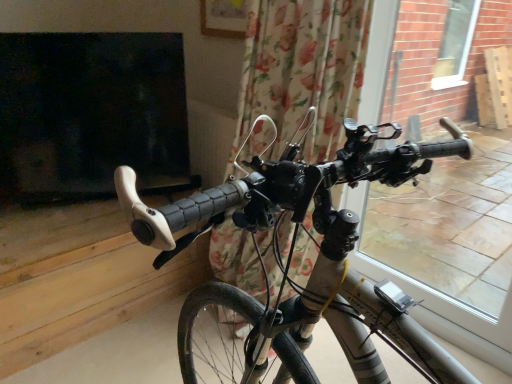
Where is `transparent glass window at right`? transparent glass window at right is located at coordinates (447, 231).

Where is `floral fabric curtain at center`? floral fabric curtain at center is located at coordinates (303, 71).

Is transparent glass window at right far away from floral fabric curtain at center?

Absolutely, transparent glass window at right is distant from floral fabric curtain at center.

Could you tell me if transparent glass window at right is turned towards floral fabric curtain at center?

Yes, transparent glass window at right is facing floral fabric curtain at center.

From a real-world perspective, is transparent glass window at right physically below floral fabric curtain at center?

Yes.

Which object is further away from the camera, transparent glass window at right or floral fabric curtain at center?

transparent glass window at right is further from the camera.

From a real-world perspective, which object rests below the other?

In real-world perspective, matte black handlebars at center is lower.

How distant is transparent glass window at right from matte black handlebars at center?

transparent glass window at right and matte black handlebars at center are 1.56 meters apart.

Considering the relative sizes of transparent glass window at right and matte black handlebars at center in the image provided, is transparent glass window at right smaller than matte black handlebars at center?

Correct, transparent glass window at right occupies less space than matte black handlebars at center.

Is matte black handlebars at center completely or partially inside transparent glass window at right?

No.

Is floral fabric curtain at center turned away from transparent glass window at right?

floral fabric curtain at center is not turned away from transparent glass window at right.

Considering the positions of point (320, 49) and point (459, 296), is point (320, 49) closer or farther from the camera than point (459, 296)?

Point (320, 49) is positioned closer to the camera compared to point (459, 296).

Between floral fabric curtain at center and transparent glass window at right, which one has larger width?

Wider between the two is floral fabric curtain at center.

In terms of width, does matte black handlebars at center look wider or thinner when compared to transparent glass window at right?

In the image, matte black handlebars at center appears to be wider than transparent glass window at right.

Considering the sizes of objects matte black handlebars at center and transparent glass window at right in the image provided, who is taller, matte black handlebars at center or transparent glass window at right?

Standing taller between the two is transparent glass window at right.

Identify the location of bicycle below the transparent glass window at right (from a real-world perspective). (316, 261).

From the image's perspective, which is below, matte black handlebars at center or transparent glass window at right?

matte black handlebars at center is shown below in the image.

Which is farther from the camera, (118, 193) or (289, 237)?

Point (289, 237)

Between matte black handlebars at center and floral fabric curtain at center, which one is positioned in front?

matte black handlebars at center is closer to the camera.

From a real-world perspective, who is located higher, matte black handlebars at center or floral fabric curtain at center?

floral fabric curtain at center, from a real-world perspective.

Is point (277, 105) positioned behind point (292, 343)?

Yes, it is behind point (292, 343).

Is matte black handlebars at center at the back of floral fabric curtain at center?

floral fabric curtain at center is not turned away from matte black handlebars at center.

Is the surface of floral fabric curtain at center in direct contact with matte black handlebars at center?

No, floral fabric curtain at center is not in contact with matte black handlebars at center.

From the image's perspective, which object appears higher, floral fabric curtain at center or matte black handlebars at center?

floral fabric curtain at center appears higher in the image.

The image size is (512, 384). I want to click on curtain that appears in front of the transparent glass window at right, so click(x=303, y=71).

Find the location of a particular element. The image size is (512, 384). bicycle that appears on the left of transparent glass window at right is located at coordinates (316, 261).

Which object lies nearer to the anchor point transparent glass window at right, matte black handlebars at center or floral fabric curtain at center?

Based on the image, floral fabric curtain at center appears to be nearer to transparent glass window at right.

Considering their positions, is matte black handlebars at center positioned closer to floral fabric curtain at center than transparent glass window at right?

matte black handlebars at center is positioned closer to the anchor floral fabric curtain at center.

Estimate the real-world distances between objects in this image. Which object is closer to matte black handlebars at center, floral fabric curtain at center or transparent glass window at right?

floral fabric curtain at center.

In the scene shown: Estimate the real-world distances between objects in this image. Which object is further from matte black handlebars at center, transparent glass window at right or floral fabric curtain at center?

The object further to matte black handlebars at center is transparent glass window at right.

Estimate the real-world distances between objects in this image. Which object is closer to floral fabric curtain at center, transparent glass window at right or matte black handlebars at center?

matte black handlebars at center is positioned closer to the anchor floral fabric curtain at center.

Based on their spatial positions, is floral fabric curtain at center or matte black handlebars at center further from transparent glass window at right?

Among the two, matte black handlebars at center is located further to transparent glass window at right.

I want to click on curtain positioned between matte black handlebars at center and transparent glass window at right from near to far, so (303, 71).